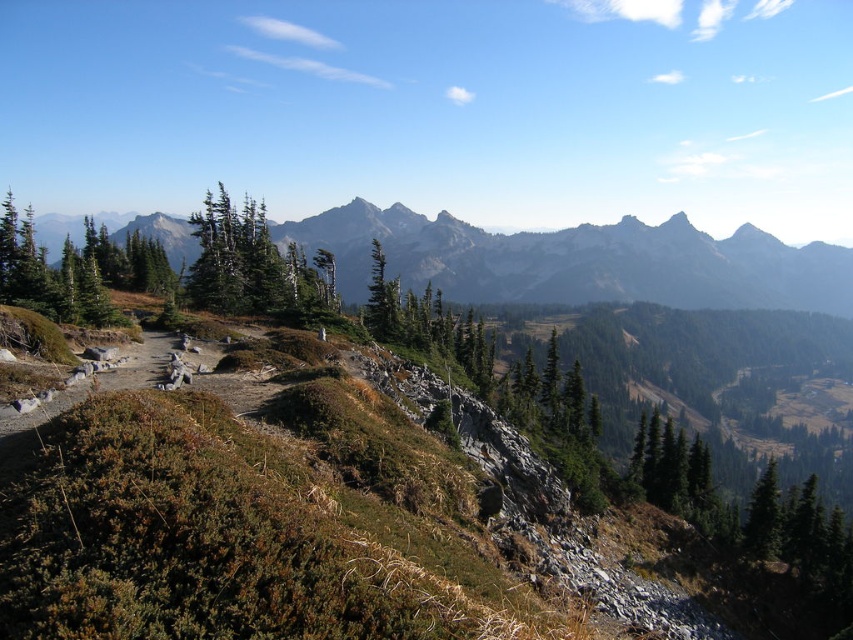
Does green matte tree at upper left appear on the right side of green matte tree at center?

In fact, green matte tree at upper left is to the left of green matte tree at center.

Is green matte tree at upper left above green matte tree at center?

No, green matte tree at upper left is not above green matte tree at center.

Is point (213, 292) farther from viewer compared to point (381, 316)?

No, (213, 292) is in front of (381, 316).

In order to click on green matte tree at upper left in this screenshot , I will do `click(254, 266)`.

Between gray rocky mountains at center and green matte tree at center, which one is positioned lower?

green matte tree at center

Can you confirm if gray rocky mountains at center is taller than green matte tree at center?

Yes, gray rocky mountains at center is taller than green matte tree at center.

Between point (757, 278) and point (372, 253), which one is positioned behind?

The point (757, 278) is more distant.

You are a GUI agent. You are given a task and a screenshot of the screen. Output one action in this format:
    pyautogui.click(x=<x>, y=<y>)
    Task: Click on the gray rocky mountains at center
    
    Given the screenshot: What is the action you would take?
    pyautogui.click(x=579, y=260)

Does gray rocky mountains at center have a lesser width compared to green matte tree at upper left?

In fact, gray rocky mountains at center might be wider than green matte tree at upper left.

Who is taller, gray rocky mountains at center or green matte tree at upper left?

Standing taller between the two is gray rocky mountains at center.

Find the location of `gray rocky mountains at center`. gray rocky mountains at center is located at coordinates (579, 260).